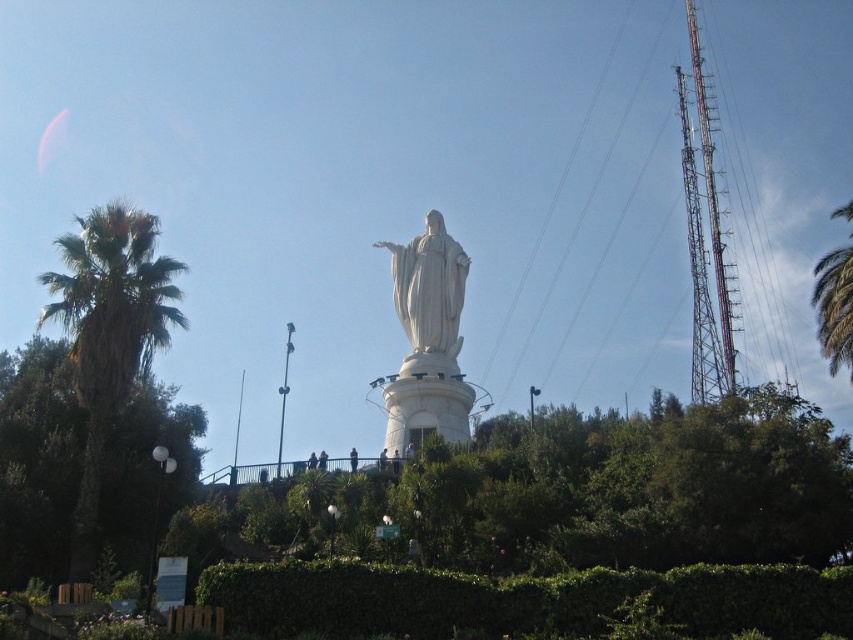
Is green leafy tree at center above green leafy hedge at lower center?

Yes, green leafy tree at center is above green leafy hedge at lower center.

Is green leafy tree at center closer to the viewer compared to green leafy hedge at lower center?

No, it is behind green leafy hedge at lower center.

Identify the location of green leafy tree at center. (579, 492).

Identify the location of green leafy tree at center. The width and height of the screenshot is (853, 640). (579, 492).

I want to click on green leafy tree at center, so click(x=579, y=492).

Which of these two, green leafy hedge at lower center or green leafy palm tree at right, stands shorter?

With less height is green leafy hedge at lower center.

From the picture: Does green leafy hedge at lower center have a smaller size compared to green leafy palm tree at right?

Yes, green leafy hedge at lower center is smaller than green leafy palm tree at right.

You are a GUI agent. You are given a task and a screenshot of the screen. Output one action in this format:
    pyautogui.click(x=<x>, y=<y>)
    Task: Click on the green leafy hedge at lower center
    Image resolution: width=853 pixels, height=640 pixels.
    Given the screenshot: What is the action you would take?
    pyautogui.click(x=521, y=600)